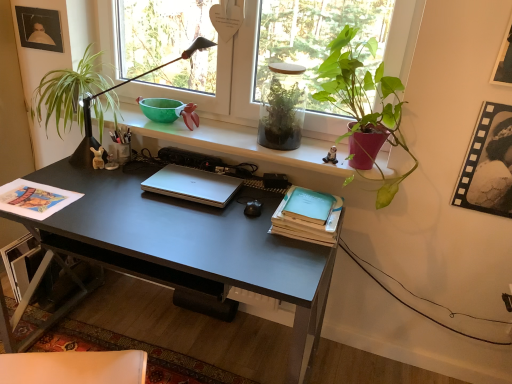
Identify the location of vacant space in front of silver metallic laptop at center. This screenshot has height=384, width=512. (179, 222).